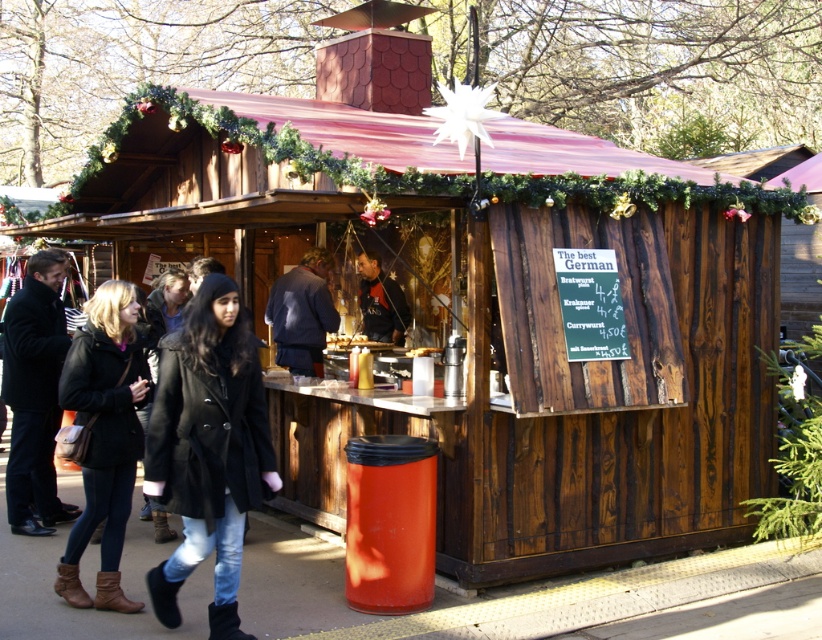
You are trying to decide which coat to wear to the market. The black wool coat at left is narrower than the dark blue fabric jacket at center. Which coat has a smaller width?

The black wool coat at left has a smaller width than the dark blue fabric jacket at center.

You are a customer at the German food stall and want to choose between the matte black coat at lower left and the dark blue fabric jacket at center. Which one is larger in size?

The matte black coat at lower left is bigger than the dark blue fabric jacket at center, so the matte black coat at lower left is larger in size.

You are standing in front of the German food stall at the Christmas market. You notice two points marked on the stall. The first point is at coordinates point [257,410] and the second is at point [91,401]. Which point is closer to you?

The point at [257,410] is closer to you than the point at [91,401] because it is positioned nearer in the scene.